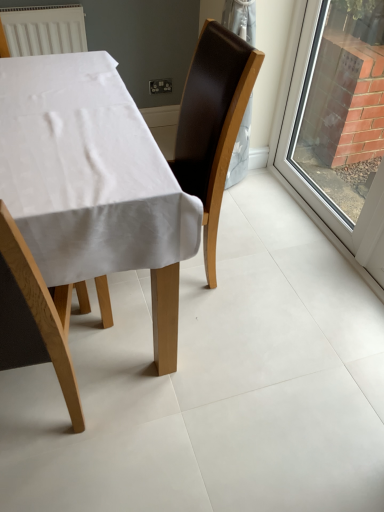
Identify the location of free space in front of wooden chair at lower left, which is counted as the second chair, starting from the back. This screenshot has height=512, width=384. (52, 484).